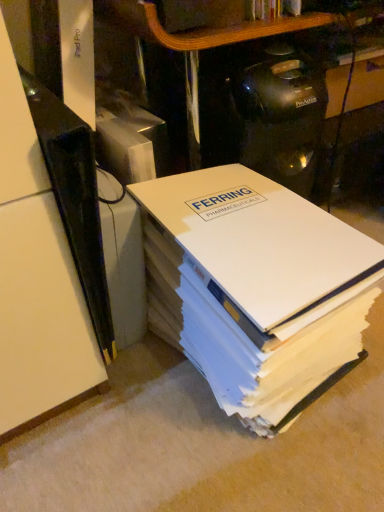
Question: Based on their positions, is white paper at center located to the left or right of black plastic shelf at left?

Choices:
 (A) right
 (B) left

Answer: (A)

Question: Is point (283, 403) closer or farther from the camera than point (3, 108)?

Choices:
 (A) farther
 (B) closer

Answer: (A)

Question: From a real-world perspective, is white paper at center positioned above or below black plastic shelf at left?

Choices:
 (A) below
 (B) above

Answer: (A)

Question: In terms of height, does black plastic shelf at left look taller or shorter compared to white paper at center?

Choices:
 (A) short
 (B) tall

Answer: (B)

Question: Is black plastic shelf at left to the left or to the right of white paper at center in the image?

Choices:
 (A) right
 (B) left

Answer: (B)

Question: In terms of width, does black plastic shelf at left look wider or thinner when compared to white paper at center?

Choices:
 (A) wide
 (B) thin

Answer: (A)

Question: Choose the correct answer: Is black plastic shelf at left inside white paper at center or outside it?

Choices:
 (A) outside
 (B) inside

Answer: (A)